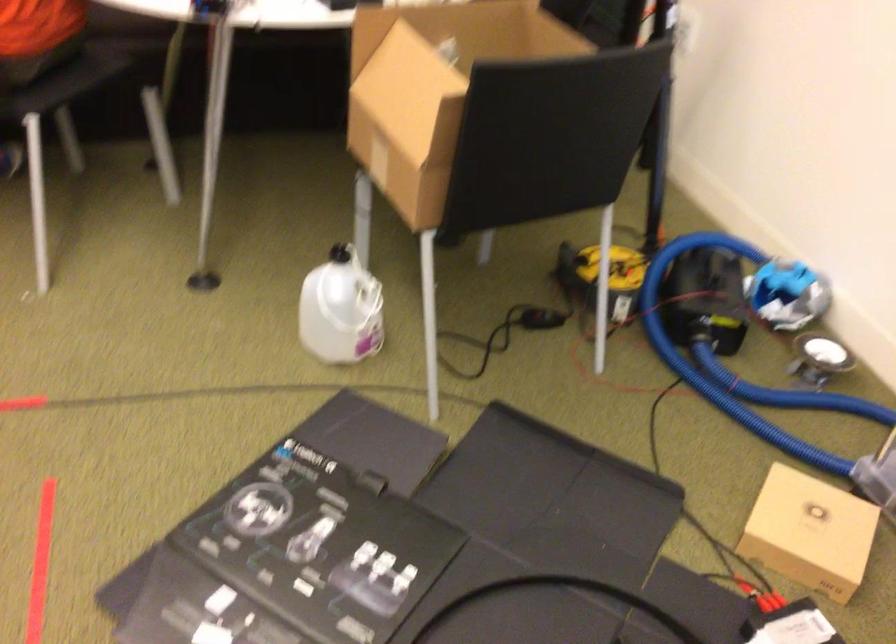
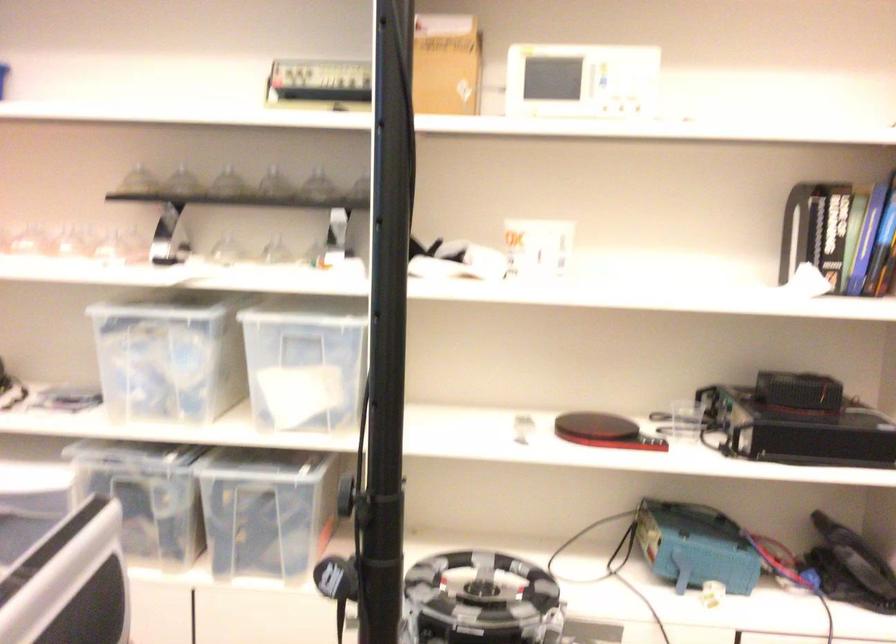
Question: The first image is from the beginning of the video and the second image is from the end. How did the camera likely rotate when shooting the video?

Choices:
 (A) Left
 (B) Right
 (C) Up
 (D) Down

Answer: (A)